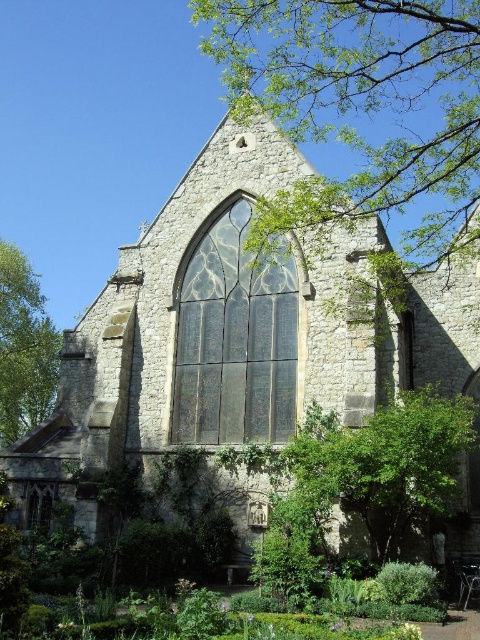
Between green leafy tree at upper center and green leafy tree at left, which one has less height?

green leafy tree at left

Identify the location of green leafy tree at upper center. The image size is (480, 640). (360, 108).

Where is `green leafy tree at upper center`? green leafy tree at upper center is located at coordinates (360, 108).